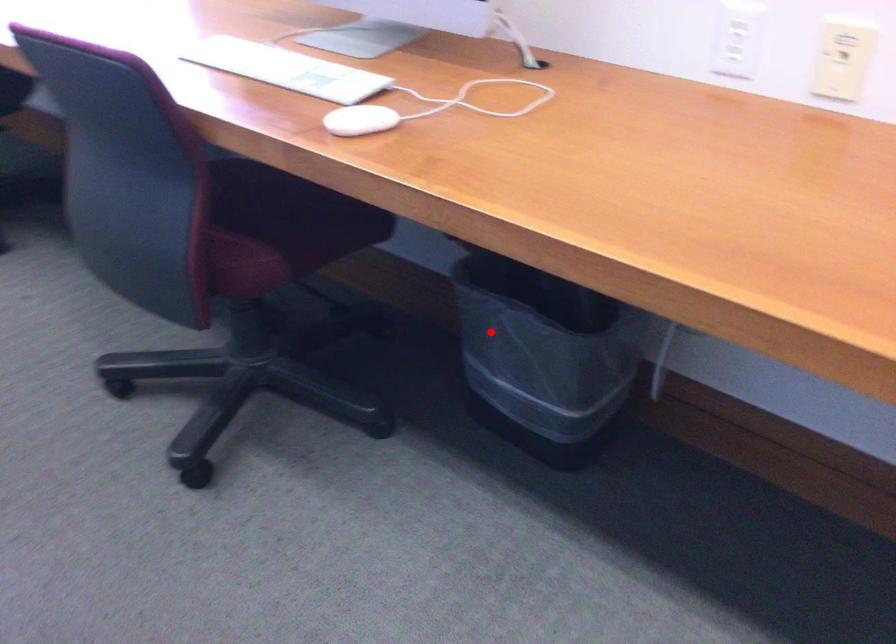
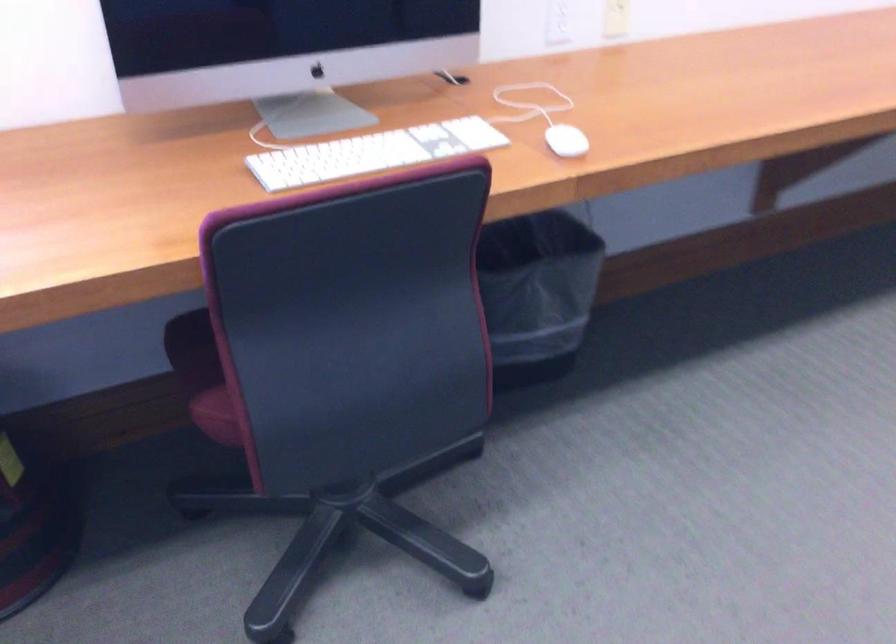
Question: I am providing you with two images of the same scene from different viewpoints. A red point is marked on the first image. Can you still see the location of the red point in image 2?

Choices:
 (A) Yes
 (B) No

Answer: (A)